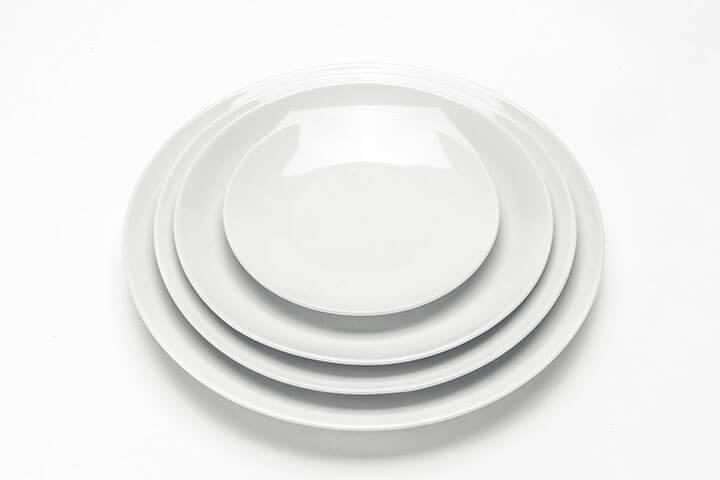
Locate an element on the screen. The image size is (720, 480). plates is located at coordinates (368, 252), (364, 342), (368, 375), (368, 410).